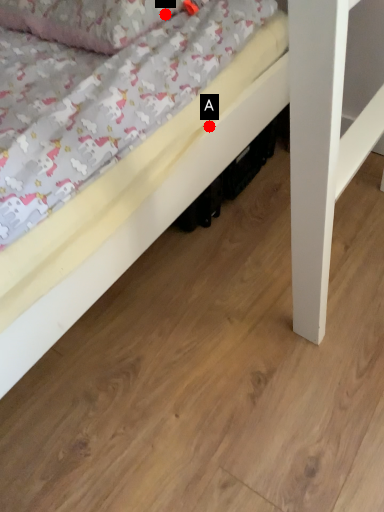
Question: Two points are circled on the image, labeled by A and B beside each circle. Which point is farther from the camera taking this photo?

Choices:
 (A) A is further
 (B) B is further

Answer: (B)